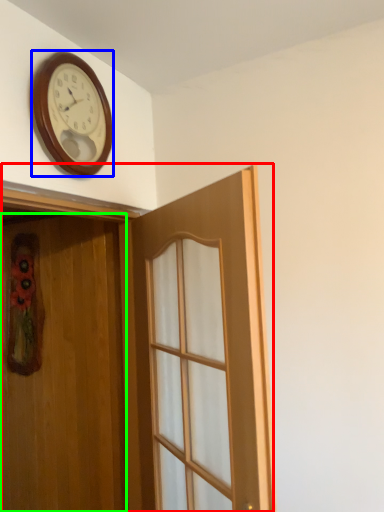
Question: Estimate the real-world distances between objects in this image. Which object is farther from door (highlighted by a red box), wall clock (highlighted by a blue box) or door (highlighted by a green box)?

Choices:
 (A) wall clock
 (B) door

Answer: (A)